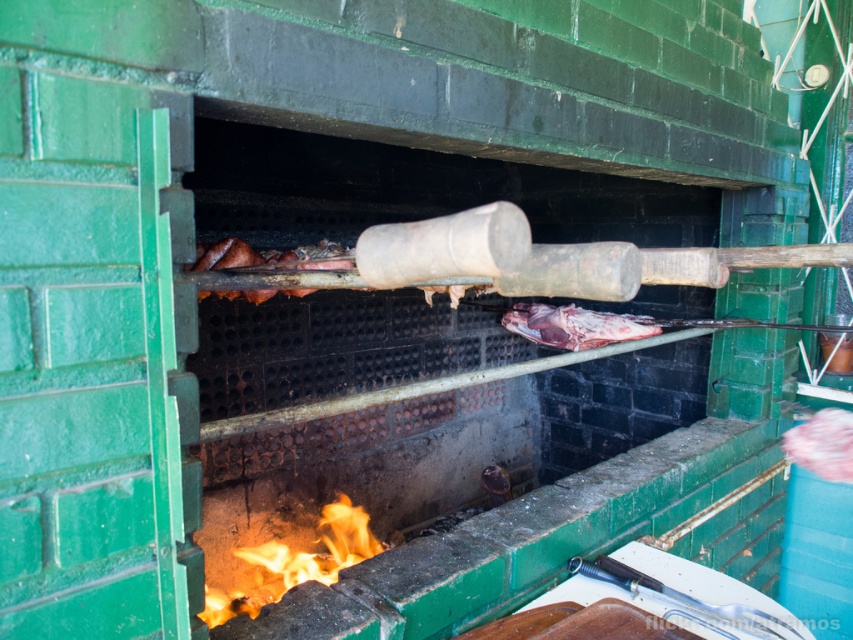
Question: Can you confirm if charcoal grill at center is positioned below raw red meat at center?

Choices:
 (A) no
 (B) yes

Answer: (B)

Question: Which object appears farthest from the camera in this image?

Choices:
 (A) charcoal grill at center
 (B) raw red meat at center

Answer: (B)

Question: Is charcoal grill at center above flametransparentfire at lower center?

Choices:
 (A) yes
 (B) no

Answer: (A)

Question: Considering the real-world distances, which object is closest to the charcoal grill at center?

Choices:
 (A) flametransparentfire at lower center
 (B) raw red meat at center

Answer: (B)

Question: Is charcoal grill at center positioned before raw red meat at center?

Choices:
 (A) no
 (B) yes

Answer: (B)

Question: Which of these objects is positioned farthest from the charcoal grill at center?

Choices:
 (A) flametransparentfire at lower center
 (B) raw red meat at center

Answer: (A)